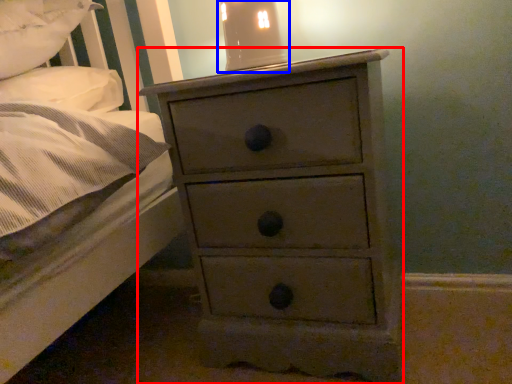
Question: Which point is closer to the camera, chest of drawers (highlighted by a red box) or bedside lamp (highlighted by a blue box)?

Choices:
 (A) chest of drawers
 (B) bedside lamp

Answer: (A)